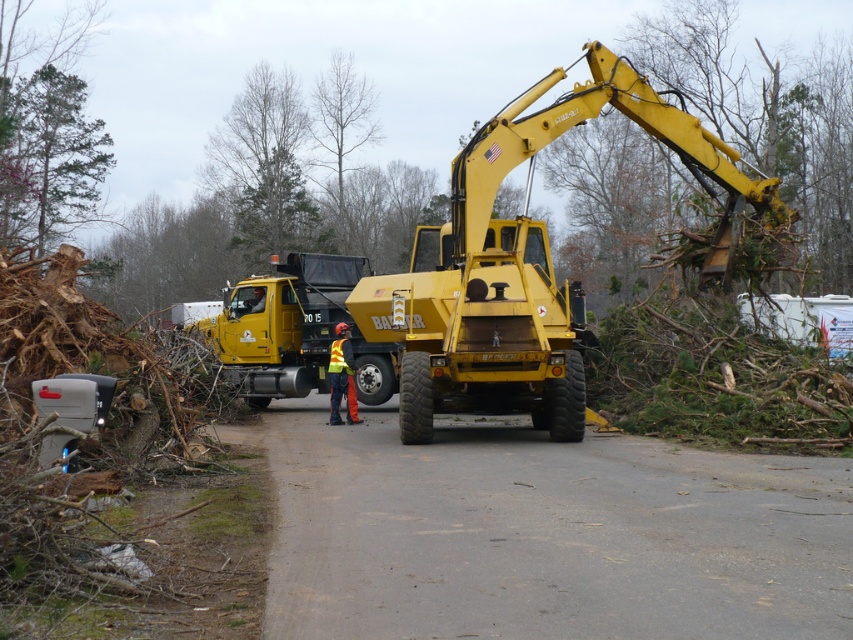
Question: Which of the following is the farthest from the observer?

Choices:
 (A) (279, 328)
 (B) (30, 224)

Answer: (B)

Question: Which object is closer to the camera taking this photo?

Choices:
 (A) reflective yellow vest at center
 (B) yellow matte dump truck at center
 (C) green leafy tree at upper center
 (D) bare wood tree at upper center

Answer: (B)

Question: Does green leafy tree at upper left appear on the right side of green leafy tree at upper center?

Choices:
 (A) no
 (B) yes

Answer: (A)

Question: Does yellow matte dump truck at center have a smaller size compared to reflective yellow vest at center?

Choices:
 (A) yes
 (B) no

Answer: (B)

Question: Does green leafy tree at upper center appear over reflective yellow vest at center?

Choices:
 (A) yes
 (B) no

Answer: (A)

Question: Which is nearer to the yellow metallic excavator at center?

Choices:
 (A) green leafy tree at upper left
 (B) yellow matte dump truck at center
 (C) green leafy tree at upper center

Answer: (B)